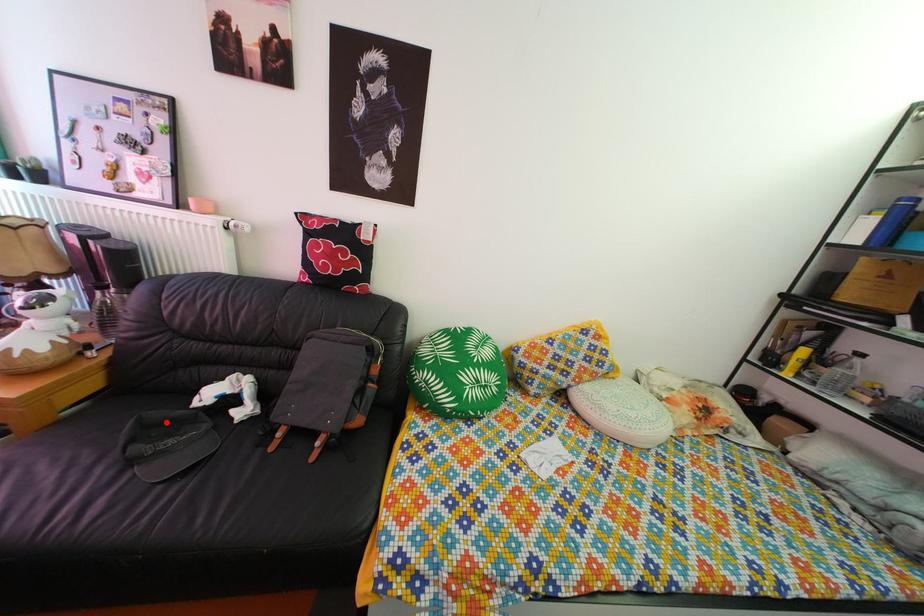
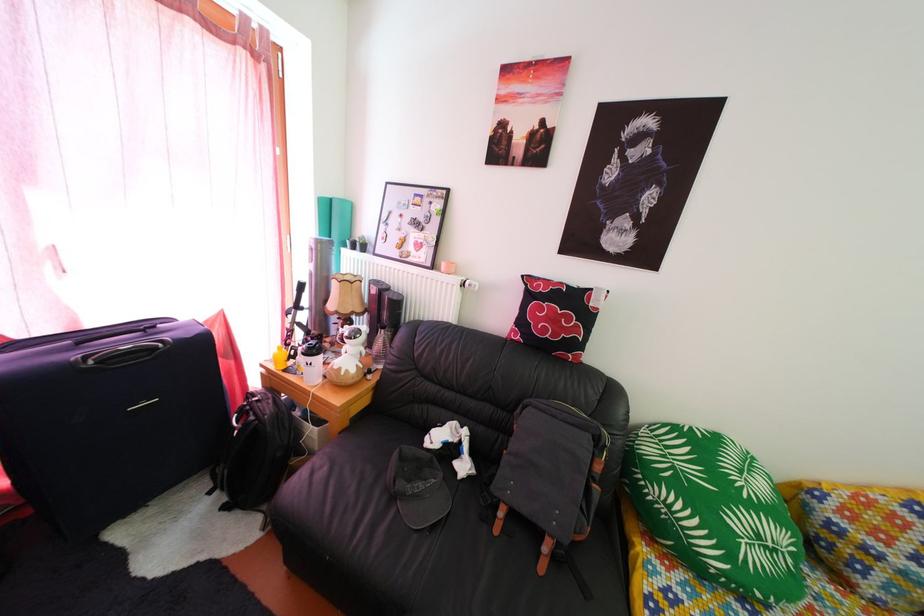
Locate, in the second image, the point that corresponds to the highlighted location in the first image.

(419, 458)